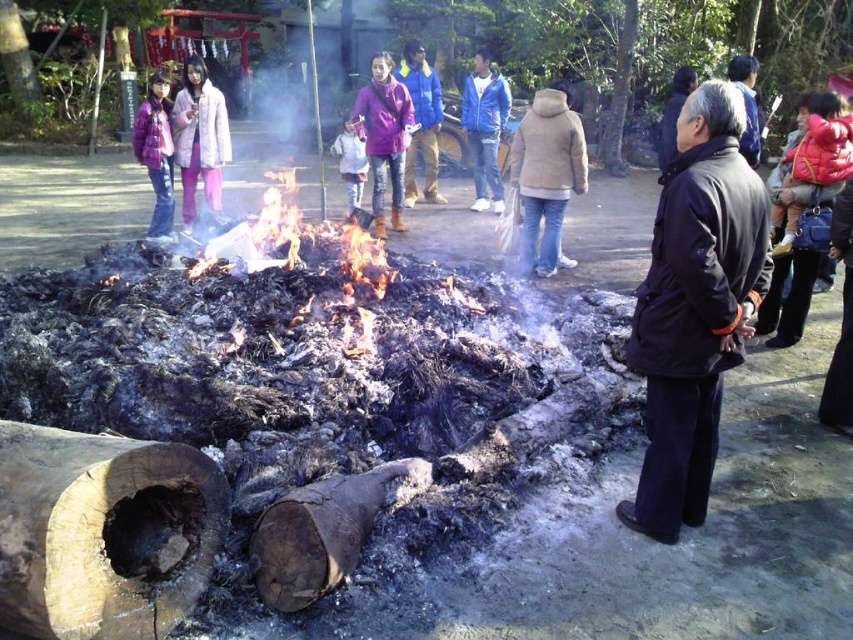
You are standing at the origin point of the coordinate system. The red puffer jacket at lower right is at position 0.466, 0.925. Is the jacket closer to the fire pit or further away compared to your current position?

The red puffer jacket at lower right is located at point (788, 298). Since you are at the origin, the distance can be calculated using the Euclidean formula. The jacket is approximately 1.03 units away from you. Without knowing the fire pit distance, I can only state its position relative to you, not the fire pit.